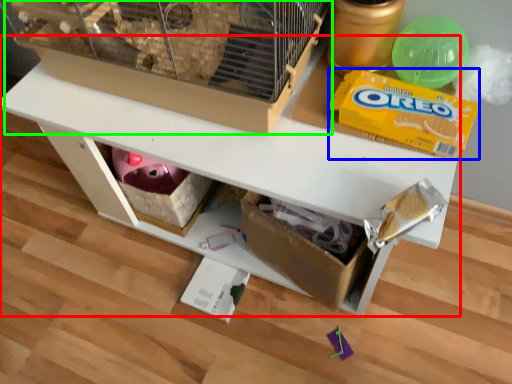
Question: Which is nearer to the table (highlighted by a red box)? cereal (highlighted by a blue box) or bird cage (highlighted by a green box).

Choices:
 (A) cereal
 (B) bird cage

Answer: (B)